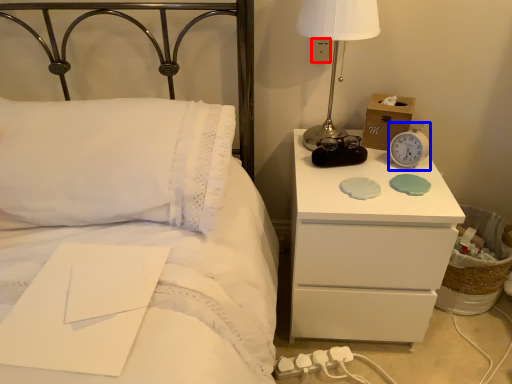
Question: Which of the following is the closest to the observer, electric outlet (highlighted by a red box) or alarm clock (highlighted by a blue box)?

Choices:
 (A) electric outlet
 (B) alarm clock

Answer: (B)